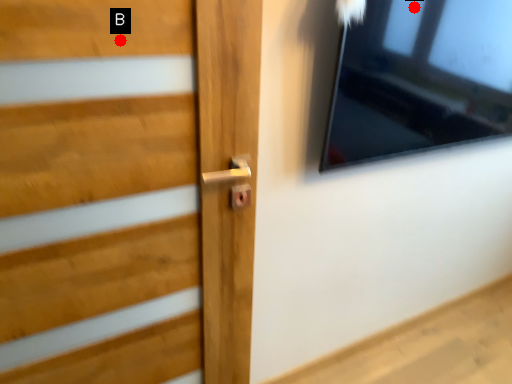
Question: Two points are circled on the image, labeled by A and B beside each circle. Which point is closer to the camera?

Choices:
 (A) A is closer
 (B) B is closer

Answer: (B)